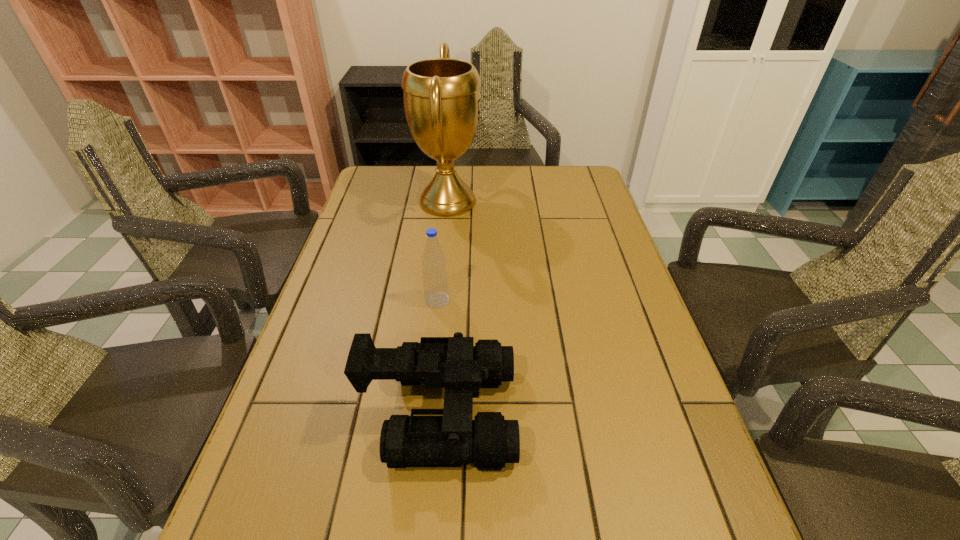
Identify the location of the tallest object. (442, 103).

You are a GUI agent. You are given a task and a screenshot of the screen. Output one action in this format:
    pyautogui.click(x=<x>, y=<y>)
    Task: Click on the farthest object
    
    Given the screenshot: What is the action you would take?
    pyautogui.click(x=442, y=103)

You are a GUI agent. You are given a task and a screenshot of the screen. Output one action in this format:
    pyautogui.click(x=<x>, y=<y>)
    Task: Click on the water bottle
    
    Given the screenshot: What is the action you would take?
    pyautogui.click(x=435, y=277)

The width and height of the screenshot is (960, 540). Identify the location of the nearest object. (489, 441).

Where is `the shortest object`? Image resolution: width=960 pixels, height=540 pixels. the shortest object is located at coordinates [x=489, y=441].

Locate an element on the screen. vacant position located 0.210m on the surface of the trophy cup with symbols is located at coordinates (545, 201).

Find the location of a particular element. The image size is (960, 540). vacant area situated on the back of the second nearest object is located at coordinates 445,218.

Find the location of a particular element. Image resolution: width=960 pixels, height=540 pixels. vacant space located 0.090m on the front lenses of the binoculars is located at coordinates (561, 413).

Locate an element on the screen. The image size is (960, 540). object that is at the far edge is located at coordinates (442, 103).

Image resolution: width=960 pixels, height=540 pixels. Find the location of `free space at the far edge of the desktop`. free space at the far edge of the desktop is located at coordinates (414, 172).